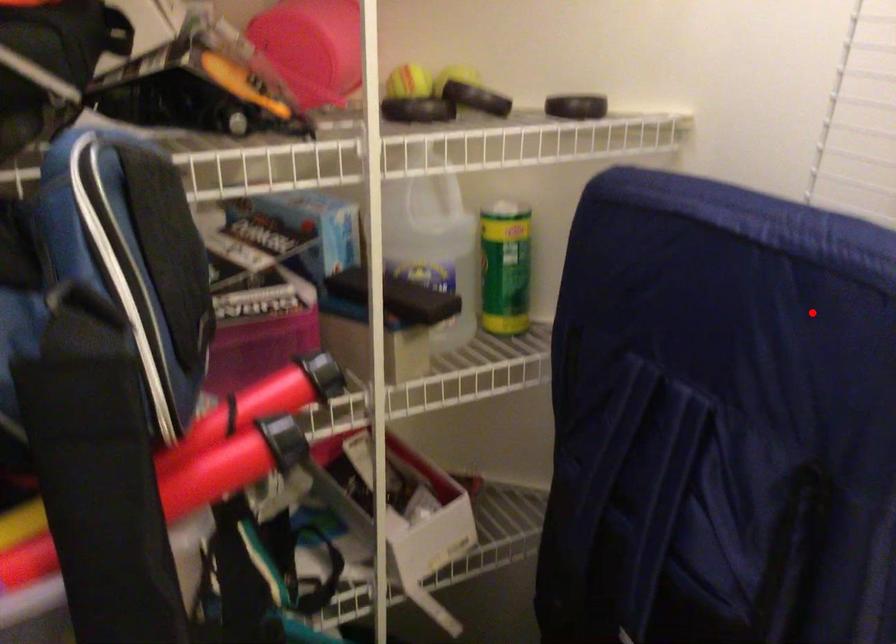
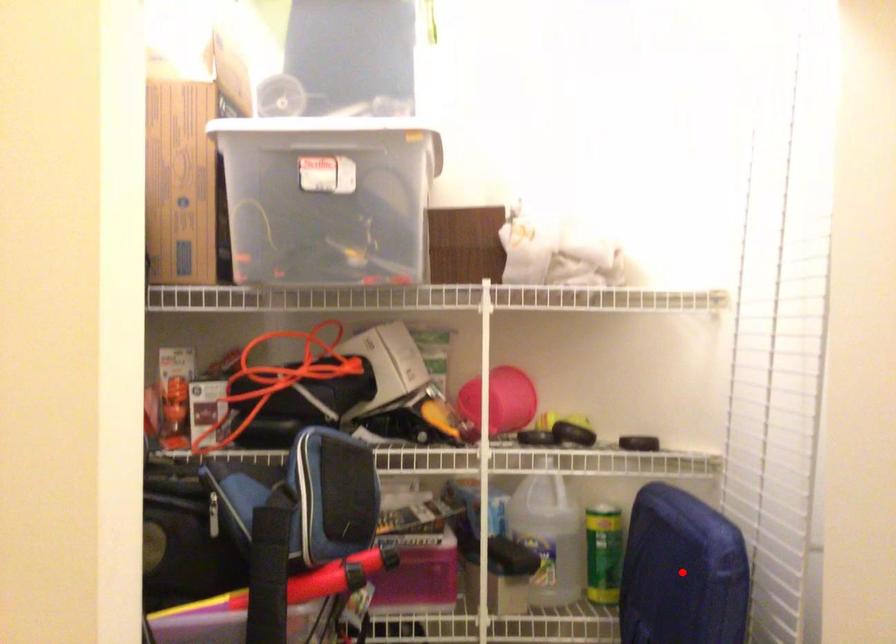
I am providing you with two images of the same scene from different viewpoints. A red point is marked on the first image and another point is marked on the second image. Does the point marked in image1 correspond to the same location as the one in image2?

Yes